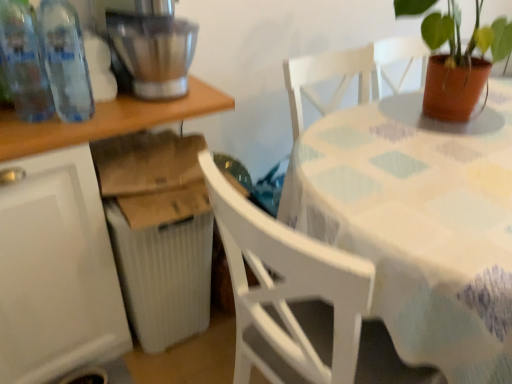
Locate an element on the screen. transparent plastic bottles at left, which is counted as the first bottle, starting from the right is located at coordinates (65, 60).

The height and width of the screenshot is (384, 512). What do you see at coordinates (147, 45) in the screenshot?
I see `brushed metal mixer at upper left` at bounding box center [147, 45].

Locate an element on the screen. Image resolution: width=512 pixels, height=384 pixels. white ribbed radiator at lower left is located at coordinates (163, 276).

This screenshot has height=384, width=512. What are the coordinates of `transparent plastic bottles at left, the second bottle positioned from the left` in the screenshot? It's located at (65, 60).

Does transparent plastic bottles at left, which is counted as the first bottle, starting from the right, come behind white ribbed radiator at lower left?

No, transparent plastic bottles at left, which is counted as the first bottle, starting from the right, is closer to the camera.

From a real-world perspective, which object stands above the other?

In real-world perspective, transparent plastic bottles at left, the second bottle positioned from the left, is above.

From the image's perspective, is transparent plastic bottles at left, which is counted as the first bottle, starting from the right, positioned above or below white ribbed radiator at lower left?

transparent plastic bottles at left, which is counted as the first bottle, starting from the right, is situated higher than white ribbed radiator at lower left in the image.

Considering the relative positions of transparent plastic bottles at left, which is counted as the first bottle, starting from the right, and white ribbed radiator at lower left in the image provided, is transparent plastic bottles at left, which is counted as the first bottle, starting from the right, to the left or to the right of white ribbed radiator at lower left?

Based on their positions, transparent plastic bottles at left, which is counted as the first bottle, starting from the right, is located to the left of white ribbed radiator at lower left.

From the image's perspective, is brushed metal mixer at upper left on white fabric-covered table at center, the 1th table when ordered from right to left?

Yes, from the image's perspective, brushed metal mixer at upper left is above white fabric-covered table at center, the 1th table when ordered from right to left.

In the scene shown: Would you say brushed metal mixer at upper left is inside or outside white fabric-covered table at center, the second table when ordered from left to right?

brushed metal mixer at upper left lies outside white fabric-covered table at center, the second table when ordered from left to right.

Does brushed metal mixer at upper left appear on the right side of white fabric-covered table at center, the second table when ordered from left to right?

No.

Could you tell me if brushed metal mixer at upper left is facing white fabric-covered table at center, the 1th table when ordered from right to left?

No, brushed metal mixer at upper left is not oriented towards white fabric-covered table at center, the 1th table when ordered from right to left.

From the image's perspective, which is above, white fabric-covered table at center, the second table when ordered from left to right, or transparent plastic bottles at left, placed as the second bottle when sorted from right to left?

transparent plastic bottles at left, placed as the second bottle when sorted from right to left.

Based on the photo, which object is wider, white fabric-covered table at center, the second table when ordered from left to right, or transparent plastic bottles at left, placed as the second bottle when sorted from right to left?

With larger width is white fabric-covered table at center, the second table when ordered from left to right.

Identify the location of the 2nd bottle behind the white fabric-covered table at center, the 1th table when ordered from right to left. (24, 62).

In terms of height, does white fabric-covered table at center, the second table when ordered from left to right, look taller or shorter compared to transparent plastic bottles at left, placed as the 1th bottle when sorted from left to right?

In the image, white fabric-covered table at center, the second table when ordered from left to right, appears to be taller than transparent plastic bottles at left, placed as the 1th bottle when sorted from left to right.

Can you confirm if white plastic table at lower left, placed as the first table when sorted from left to right, is bigger than white fabric-covered table at center, the 1th table when ordered from right to left?

Actually, white plastic table at lower left, placed as the first table when sorted from left to right, might be smaller than white fabric-covered table at center, the 1th table when ordered from right to left.

Based on the photo, which object is positioned more to the right, white plastic table at lower left, placed as the first table when sorted from left to right, or white fabric-covered table at center, the 1th table when ordered from right to left?

Positioned to the right is white fabric-covered table at center, the 1th table when ordered from right to left.

Is white plastic table at lower left, placed as the first table when sorted from left to right, taller than white fabric-covered table at center, the second table when ordered from left to right?

Indeed, white plastic table at lower left, placed as the first table when sorted from left to right, has a greater height compared to white fabric-covered table at center, the second table when ordered from left to right.

From a real-world perspective, is white plastic table at lower left, positioned as the second table in right-to-left order, positioned under white fabric-covered table at center, the 1th table when ordered from right to left, based on gravity?

No, from a real-world perspective, white plastic table at lower left, positioned as the second table in right-to-left order, is not beneath white fabric-covered table at center, the 1th table when ordered from right to left.

From the image's perspective, which is above, terracotta pot at table or brushed metal mixer at upper left?

From the image's view, terracotta pot at table is above.

Which point is more forward, (443, 62) or (166, 67)?

Point (166, 67)

Looking at this image, which object is wider, terracotta pot at table or brushed metal mixer at upper left?

Wider between the two is terracotta pot at table.

Can you confirm if transparent plastic bottles at left, placed as the 1th bottle when sorted from left to right, is shorter than transparent plastic bottles at left, the second bottle positioned from the left?

Incorrect, the height of transparent plastic bottles at left, placed as the 1th bottle when sorted from left to right, does not fall short of that of transparent plastic bottles at left, the second bottle positioned from the left.

Consider the image. From the image's perspective, is transparent plastic bottles at left, placed as the 1th bottle when sorted from left to right, below transparent plastic bottles at left, the second bottle positioned from the left?

Indeed, from the image's perspective, transparent plastic bottles at left, placed as the 1th bottle when sorted from left to right, is shown beneath transparent plastic bottles at left, the second bottle positioned from the left.

Is point (30, 67) positioned after point (78, 91)?

No, (30, 67) is in front of (78, 91).

Can you see white ribbed radiator at lower left touching transparent plastic bottles at left, which is counted as the first bottle, starting from the right?

There is a gap between white ribbed radiator at lower left and transparent plastic bottles at left, which is counted as the first bottle, starting from the right.

Who is bigger, white ribbed radiator at lower left or transparent plastic bottles at left, the second bottle positioned from the left?

white ribbed radiator at lower left.

From a real-world perspective, which bottle is the 1st one above the white ribbed radiator at lower left? Please provide its 2D coordinates.

[(65, 60)]

Identify the location of the 1st bottle counting from the left side of the white ribbed radiator at lower left. (65, 60).

This screenshot has width=512, height=384. In order to click on the 2nd table in front when counting from the brushed metal mixer at upper left in this screenshot , I will do `click(419, 223)`.

Based on their spatial positions, is white fabric-covered table at center, the 1th table when ordered from right to left, or transparent plastic bottles at left, which is counted as the first bottle, starting from the right, closer to terracotta pot at table?

Based on the image, white fabric-covered table at center, the 1th table when ordered from right to left, appears to be nearer to terracotta pot at table.

Looking at the image, which one is located closer to transparent plastic bottles at left, placed as the second bottle when sorted from right to left, white ribbed radiator at lower left or transparent plastic bottles at left, the second bottle positioned from the left?

transparent plastic bottles at left, the second bottle positioned from the left, lies closer to transparent plastic bottles at left, placed as the second bottle when sorted from right to left, than the other object.

From the image, which object appears to be nearer to white plastic table at lower left, placed as the first table when sorted from left to right, white fabric-covered table at center, the 1th table when ordered from right to left, or transparent plastic bottles at left, the second bottle positioned from the left?

Based on the image, transparent plastic bottles at left, the second bottle positioned from the left, appears to be nearer to white plastic table at lower left, placed as the first table when sorted from left to right.

When comparing their distances from transparent plastic bottles at left, placed as the second bottle when sorted from right to left, does terracotta pot at table or white plastic table at lower left, placed as the first table when sorted from left to right, seem further?

Based on the image, terracotta pot at table appears to be further to transparent plastic bottles at left, placed as the second bottle when sorted from right to left.

Which object lies nearer to the anchor point transparent plastic bottles at left, placed as the 1th bottle when sorted from left to right, white fabric-covered table at center, the second table when ordered from left to right, or terracotta pot at table?

white fabric-covered table at center, the second table when ordered from left to right.

Based on their spatial positions, is transparent plastic bottles at left, the second bottle positioned from the left, or terracotta pot at table closer to white plastic table at lower left, placed as the first table when sorted from left to right?

The object closer to white plastic table at lower left, placed as the first table when sorted from left to right, is transparent plastic bottles at left, the second bottle positioned from the left.

When comparing their distances from terracotta pot at table, does transparent plastic bottles at left, placed as the 1th bottle when sorted from left to right, or transparent plastic bottles at left, the second bottle positioned from the left, seem closer?

transparent plastic bottles at left, the second bottle positioned from the left, is closer to terracotta pot at table.

From the image, which object appears to be farther from white fabric-covered table at center, the 1th table when ordered from right to left, white plastic table at lower left, placed as the first table when sorted from left to right, or transparent plastic bottles at left, placed as the second bottle when sorted from right to left?

The object further to white fabric-covered table at center, the 1th table when ordered from right to left, is transparent plastic bottles at left, placed as the second bottle when sorted from right to left.

Locate an element on the screen. mixer located between transparent plastic bottles at left, placed as the 1th bottle when sorted from left to right, and white fabric-covered table at center, the second table when ordered from left to right, in the left-right direction is located at coordinates (147, 45).

The width and height of the screenshot is (512, 384). Find the location of `houseplant between transparent plastic bottles at left, the second bottle positioned from the left, and white fabric-covered table at center, the second table when ordered from left to right`. houseplant between transparent plastic bottles at left, the second bottle positioned from the left, and white fabric-covered table at center, the second table when ordered from left to right is located at coordinates (460, 62).

Find the location of `mixer located between transparent plastic bottles at left, the second bottle positioned from the left, and white fabric-covered table at center, the 1th table when ordered from right to left, in the left-right direction`. mixer located between transparent plastic bottles at left, the second bottle positioned from the left, and white fabric-covered table at center, the 1th table when ordered from right to left, in the left-right direction is located at coordinates (147, 45).

You are a GUI agent. You are given a task and a screenshot of the screen. Output one action in this format:
    pyautogui.click(x=<x>, y=<y>)
    Task: Click on the bottle between white plastic table at lower left, placed as the first table when sorted from left to right, and terracotta pot at table from left to right
    
    Given the screenshot: What is the action you would take?
    pyautogui.click(x=65, y=60)